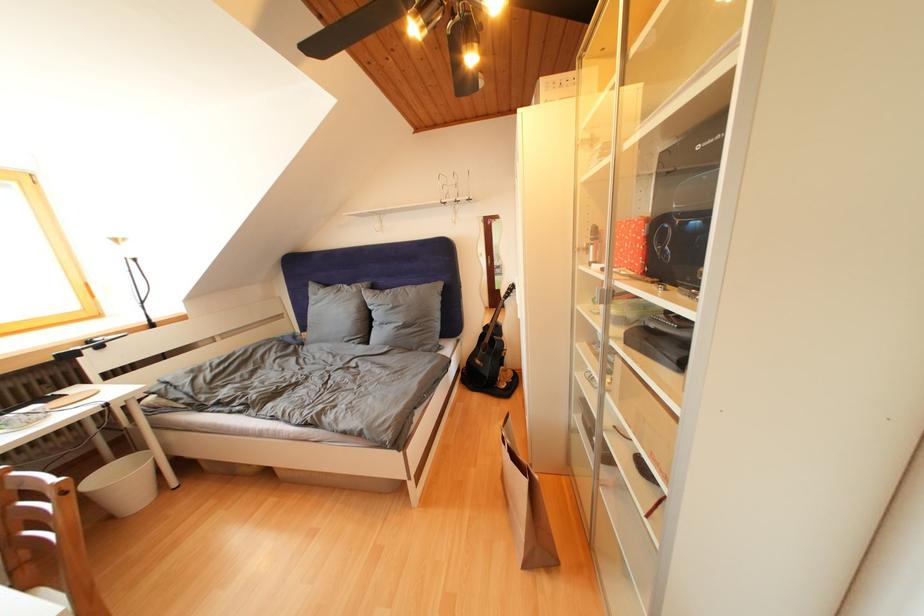
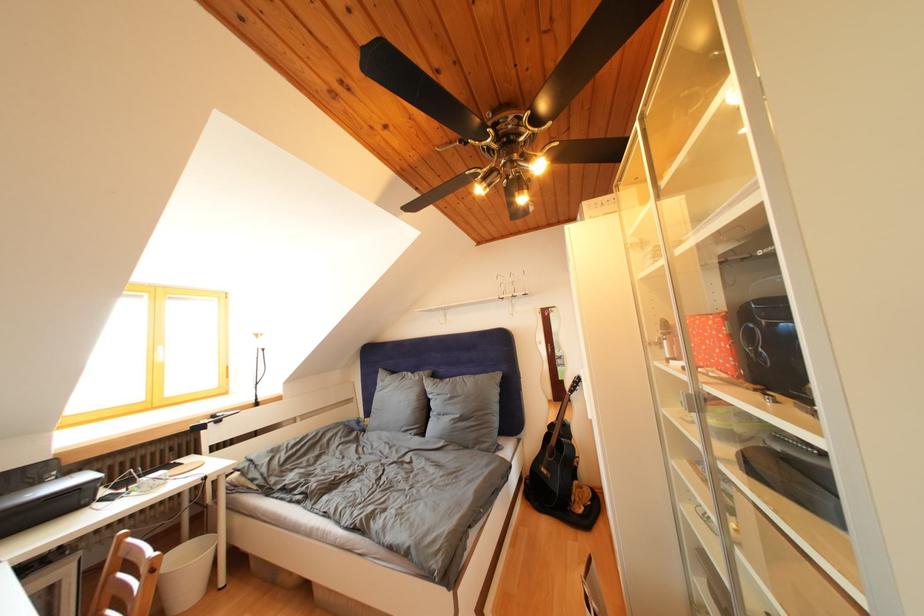
Question: Based on the continuous images, in which direction is the camera rotating? Reply with the corresponding letter.

Choices:
 (A) Left
 (B) Right
 (C) Up
 (D) Down

Answer: (C)